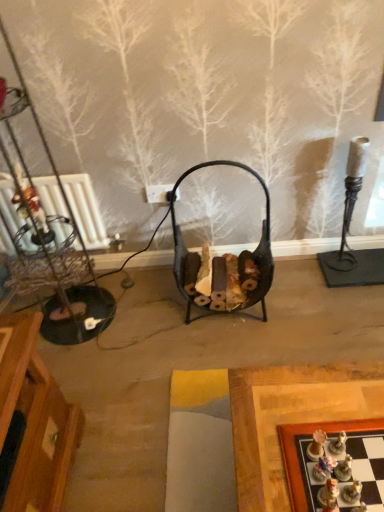
You are a GUI agent. You are given a task and a screenshot of the screen. Output one action in this format:
    pyautogui.click(x=<x>, y=<y>)
    Task: Click on the vacant area to the right of black metal basket at center
    This screenshot has width=384, height=512.
    Given the screenshot: What is the action you would take?
    pyautogui.click(x=301, y=297)